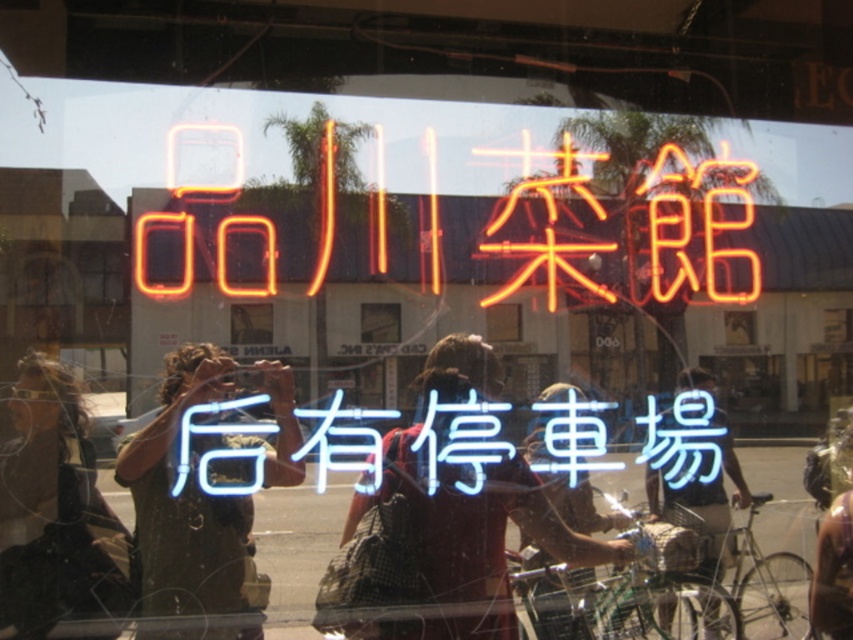
From the picture: You are a photographer trying to capture both the red fabric shirt at center and the neon orange characters at center in a single shot. Given that your camera has a 3.5 inch wide lens, will you be able to fit both objects into the frame without moving the camera?

The red fabric shirt at center and neon orange characters at center are 4.88 inches apart, which is wider than the 3.5 inch lens width. Therefore, the camera lens is not wide enough to capture both objects in a single shot without moving the camera.

You are a photographer standing in front of a window that reflects the scene outside. You notice two people reflected in the window. One is wearing a green matte shirt at left and the other a red fabric shirt at center. Which of the two shirts is narrower in width?

The green matte shirt at left is thinner than the red fabric shirt at center, so the green matte shirt at left is narrower in width.

You are standing in front of a reflective window displaying a neon sign and people outside. You see a red fabric shirt at center and neon orange characters at center. Which object is positioned more to the right side of the window?

The red fabric shirt at center is positioned more to the right side of the window than the neon orange characters at center.